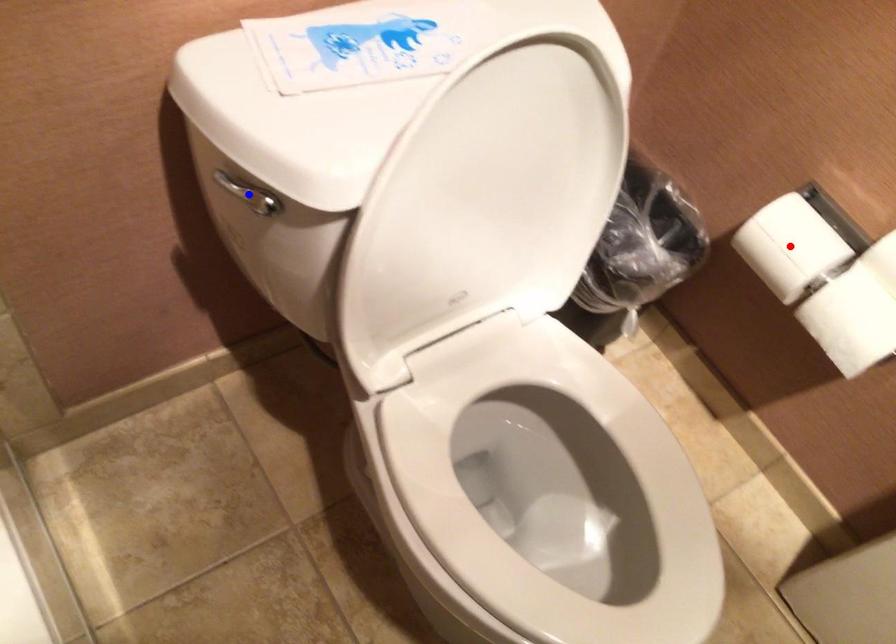
Question: Two points are marked on the image. Which point is closer to the camera?

Choices:
 (A) Blue point is closer.
 (B) Red point is closer.

Answer: (A)